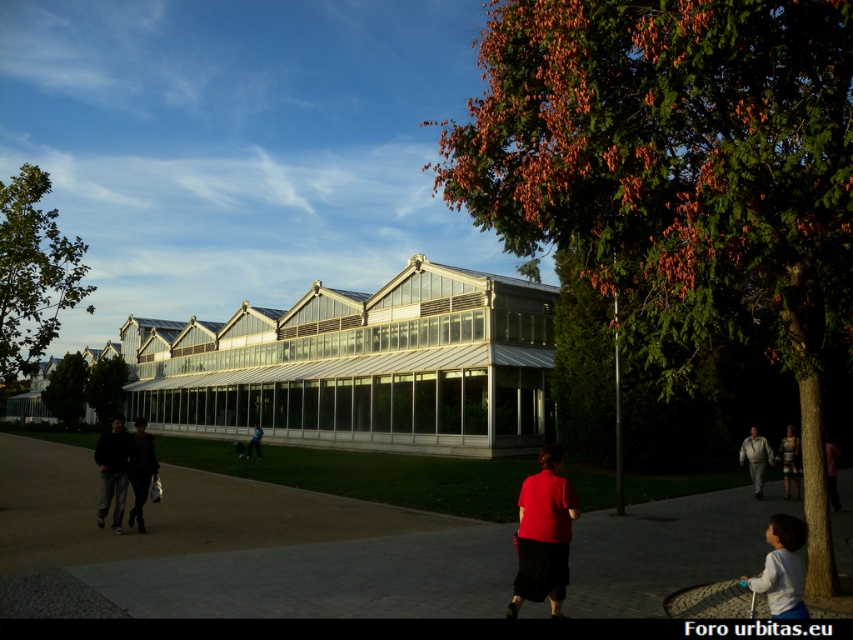
Does dark gray sweater at left appear under green leafy tree at upper center?

Incorrect, dark gray sweater at left is not positioned below green leafy tree at upper center.

This screenshot has height=640, width=853. I want to click on dark gray sweater at left, so click(x=112, y=470).

Is orange-brown foliage at center above green leafy tree at center-left?

Yes, orange-brown foliage at center is above green leafy tree at center-left.

Can you confirm if orange-brown foliage at center is bigger than green leafy tree at center-left?

Indeed, orange-brown foliage at center has a larger size compared to green leafy tree at center-left.

Consider the image. Who is more distant from viewer, (x=670, y=106) or (x=62, y=387)?

The point (x=62, y=387) is more distant.

This screenshot has width=853, height=640. In order to click on orange-brown foliage at center in this screenshot , I will do `click(679, 177)`.

Is dark brown leather jacket at left shorter than light gray suit at lower right?

In fact, dark brown leather jacket at left may be taller than light gray suit at lower right.

Is point (138, 499) less distant than point (752, 468)?

Yes.

Is point (138, 483) farther from viewer compared to point (770, 452)?

No, it is not.

The image size is (853, 640). I want to click on dark brown leather jacket at left, so 140,468.